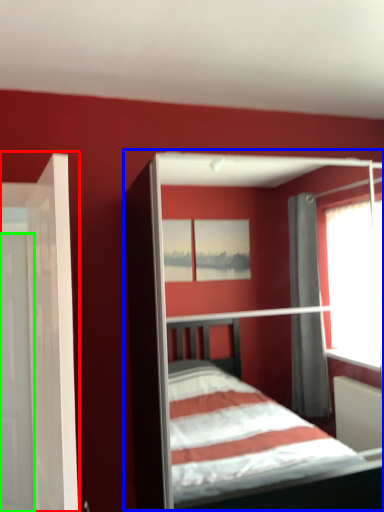
Question: Considering the real-world distances, which object is farthest from door (highlighted by a red box)? bed (highlighted by a blue box) or door (highlighted by a green box)?

Choices:
 (A) bed
 (B) door

Answer: (A)